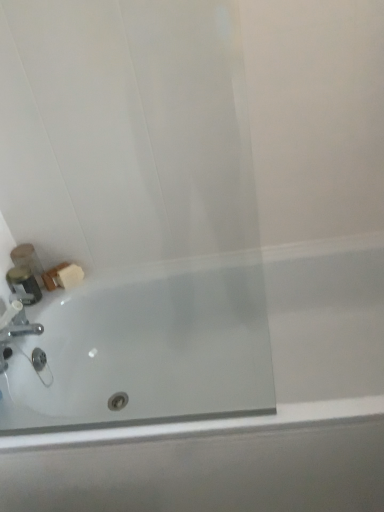
What is the approximate height of matte plastic soap at lower left, the 1th toiletry in the back-to-front sequence?

matte plastic soap at lower left, the 1th toiletry in the back-to-front sequence, is 7.00 inches in height.

Describe the element at coordinates (23, 285) in the screenshot. This screenshot has height=512, width=384. I see `metallic silver container at left, the 1th toiletry when ordered from front to back` at that location.

Where is `silver metallic faucet at lower left`? silver metallic faucet at lower left is located at coordinates (15, 328).

Find the location of a particular element. matte plastic soap at lower left, the 2th toiletry from the front is located at coordinates (28, 260).

At what (x,y) coordinates should I click in order to perform the action: click on tap behind the white glossy bathtub at lower left. Please return your answer as a coordinate pair (x, y). This screenshot has width=384, height=512. Looking at the image, I should click on (15, 328).

Is white glossy bathtub at lower left not near silver metallic faucet at lower left?

That's not correct — white glossy bathtub at lower left is a little close to silver metallic faucet at lower left.

Is point (330, 373) closer to camera compared to point (1, 317)?

No, (330, 373) is behind (1, 317).

Is white glossy bathtub at lower left thinner than silver metallic faucet at lower left?

In fact, white glossy bathtub at lower left might be wider than silver metallic faucet at lower left.

Considering the relative sizes of matte plastic soap at lower left, the 1th toiletry in the back-to-front sequence, and metallic silver container at left, the 1th toiletry when ordered from front to back, in the image provided, is matte plastic soap at lower left, the 1th toiletry in the back-to-front sequence, shorter than metallic silver container at left, the 1th toiletry when ordered from front to back,?

In fact, matte plastic soap at lower left, the 1th toiletry in the back-to-front sequence, may be taller than metallic silver container at left, the 1th toiletry when ordered from front to back.

Which is more to the left, matte plastic soap at lower left, the 2th toiletry from the front, or metallic silver container at left, the second toiletry positioned from the back?

metallic silver container at left, the second toiletry positioned from the back.

Is matte plastic soap at lower left, the 2th toiletry from the front, bigger than metallic silver container at left, the 1th toiletry when ordered from front to back?

Correct, matte plastic soap at lower left, the 2th toiletry from the front, is larger in size than metallic silver container at left, the 1th toiletry when ordered from front to back.

From the image's perspective, who appears lower, matte plastic soap at lower left, the 1th toiletry in the back-to-front sequence, or metallic silver container at left, the second toiletry positioned from the back?

metallic silver container at left, the second toiletry positioned from the back, is shown below in the image.

Is white glossy bathtub at lower left at the right side of metallic silver container at left, the second toiletry positioned from the back?

Indeed, white glossy bathtub at lower left is positioned on the right side of metallic silver container at left, the second toiletry positioned from the back.

Is white glossy bathtub at lower left facing towards metallic silver container at left, the second toiletry positioned from the back?

No, white glossy bathtub at lower left does not turn towards metallic silver container at left, the second toiletry positioned from the back.

Measure the distance between white glossy bathtub at lower left and metallic silver container at left, the second toiletry positioned from the back.

white glossy bathtub at lower left is 74.37 centimeters from metallic silver container at left, the second toiletry positioned from the back.

From the image's perspective, which is below, white glossy bathtub at lower left or metallic silver container at left, the second toiletry positioned from the back?

white glossy bathtub at lower left, from the image's perspective.

From a real-world perspective, is metallic silver container at left, the second toiletry positioned from the back, positioned over white glossy bathtub at lower left based on gravity?

Indeed, from a real-world perspective, metallic silver container at left, the second toiletry positioned from the back, stands above white glossy bathtub at lower left.

Between metallic silver container at left, the 1th toiletry when ordered from front to back, and white glossy bathtub at lower left, which one is positioned in front?

white glossy bathtub at lower left.

How different are the orientations of metallic silver container at left, the second toiletry positioned from the back, and white glossy bathtub at lower left in degrees?

The facing directions of metallic silver container at left, the second toiletry positioned from the back, and white glossy bathtub at lower left are 89.8 degrees apart.

Could you measure the distance between metallic silver container at left, the second toiletry positioned from the back, and white glossy bathtub at lower left?

metallic silver container at left, the second toiletry positioned from the back, and white glossy bathtub at lower left are 29.28 inches apart from each other.

From the image's perspective, is silver metallic faucet at lower left above or below matte plastic soap at lower left, the 2th toiletry from the front?

silver metallic faucet at lower left is situated lower than matte plastic soap at lower left, the 2th toiletry from the front, in the image.

Between silver metallic faucet at lower left and matte plastic soap at lower left, the 2th toiletry from the front, which one has more height?

Standing taller between the two is matte plastic soap at lower left, the 2th toiletry from the front.

Would you say silver metallic faucet at lower left is inside or outside matte plastic soap at lower left, the 2th toiletry from the front?

silver metallic faucet at lower left is outside matte plastic soap at lower left, the 2th toiletry from the front.

Looking at their sizes, would you say metallic silver container at left, the second toiletry positioned from the back, is wider or thinner than matte plastic soap at lower left, the 2th toiletry from the front?

Considering their sizes, metallic silver container at left, the second toiletry positioned from the back, looks slimmer than matte plastic soap at lower left, the 2th toiletry from the front.

At what (x,y) coordinates should I click in order to perform the action: click on toiletry above the metallic silver container at left, the second toiletry positioned from the back (from the image's perspective). Please return your answer as a coordinate pair (x, y). The height and width of the screenshot is (512, 384). Looking at the image, I should click on (28, 260).

Is metallic silver container at left, the second toiletry positioned from the back, touching matte plastic soap at lower left, the 2th toiletry from the front?

Yes, metallic silver container at left, the second toiletry positioned from the back, is in contact with matte plastic soap at lower left, the 2th toiletry from the front.

Is silver metallic faucet at lower left not near white glossy bathtub at lower left?

No, there isn't a large distance between silver metallic faucet at lower left and white glossy bathtub at lower left.

From the picture: Is silver metallic faucet at lower left not within white glossy bathtub at lower left?

Yes, silver metallic faucet at lower left is located beyond the bounds of white glossy bathtub at lower left.

Find the location of a particular element. The image size is (384, 512). tap above the white glossy bathtub at lower left (from a real-world perspective) is located at coordinates (15, 328).

From a real-world perspective, who is located lower, silver metallic faucet at lower left or white glossy bathtub at lower left?

white glossy bathtub at lower left.

Identify the location of bathtub in front of the silver metallic faucet at lower left. The image size is (384, 512). (248, 417).

In order to click on toiletry on the left side of matte plastic soap at lower left, the 1th toiletry in the back-to-front sequence in this screenshot , I will do `click(23, 285)`.

Which object lies further to the anchor point metallic silver container at left, the 1th toiletry when ordered from front to back, white glossy bathtub at lower left or matte plastic soap at lower left, the 2th toiletry from the front?

Among the two, white glossy bathtub at lower left is located further to metallic silver container at left, the 1th toiletry when ordered from front to back.

Based on their spatial positions, is white glossy bathtub at lower left or metallic silver container at left, the second toiletry positioned from the back, further from silver metallic faucet at lower left?

white glossy bathtub at lower left is positioned further to the anchor silver metallic faucet at lower left.

Considering their positions, is silver metallic faucet at lower left positioned closer to white glossy bathtub at lower left than matte plastic soap at lower left, the 2th toiletry from the front?

silver metallic faucet at lower left.

Looking at the image, which one is located closer to silver metallic faucet at lower left, white glossy bathtub at lower left or matte plastic soap at lower left, the 2th toiletry from the front?

Based on the image, matte plastic soap at lower left, the 2th toiletry from the front, appears to be nearer to silver metallic faucet at lower left.

When comparing their distances from metallic silver container at left, the second toiletry positioned from the back, does white glossy bathtub at lower left or silver metallic faucet at lower left seem closer?

silver metallic faucet at lower left.

Estimate the real-world distances between objects in this image. Which object is closer to silver metallic faucet at lower left, metallic silver container at left, the 1th toiletry when ordered from front to back, or white glossy bathtub at lower left?

metallic silver container at left, the 1th toiletry when ordered from front to back, lies closer to silver metallic faucet at lower left than the other object.

Based on the photo, estimate the real-world distances between objects in this image. Which object is further from white glossy bathtub at lower left, metallic silver container at left, the 1th toiletry when ordered from front to back, or matte plastic soap at lower left, the 2th toiletry from the front?

matte plastic soap at lower left, the 2th toiletry from the front, is positioned further to the anchor white glossy bathtub at lower left.

Estimate the real-world distances between objects in this image. Which object is closer to metallic silver container at left, the second toiletry positioned from the back, matte plastic soap at lower left, the 1th toiletry in the back-to-front sequence, or silver metallic faucet at lower left?

matte plastic soap at lower left, the 1th toiletry in the back-to-front sequence, is positioned closer to the anchor metallic silver container at left, the second toiletry positioned from the back.

What are the coordinates of `toiletry situated between metallic silver container at left, the second toiletry positioned from the back, and white glossy bathtub at lower left from left to right` in the screenshot? It's located at (28, 260).

This screenshot has height=512, width=384. Find the location of `tap between matte plastic soap at lower left, the 2th toiletry from the front, and white glossy bathtub at lower left`. tap between matte plastic soap at lower left, the 2th toiletry from the front, and white glossy bathtub at lower left is located at coordinates (15, 328).

Where is `tap between metallic silver container at left, the 1th toiletry when ordered from front to back, and white glossy bathtub at lower left, in the horizontal direction`? tap between metallic silver container at left, the 1th toiletry when ordered from front to back, and white glossy bathtub at lower left, in the horizontal direction is located at coordinates (15, 328).

Find the location of a particular element. toiletry located between silver metallic faucet at lower left and matte plastic soap at lower left, the 2th toiletry from the front, in the depth direction is located at coordinates (23, 285).